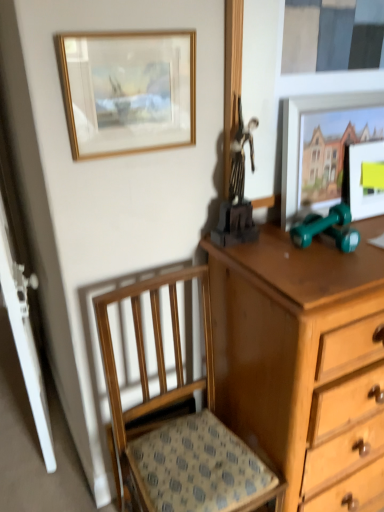
Question: Is shiny black statue at upper center, which is counted as the second toy, starting from the right, positioned behind gold-framed painting at upper left, acting as the first picture frame starting from the left?

Choices:
 (A) no
 (B) yes

Answer: (B)

Question: From the image's perspective, does shiny black statue at upper center, arranged as the 1th toy when viewed from the left, appear higher than gold-framed painting at upper left, acting as the first picture frame starting from the left?

Choices:
 (A) no
 (B) yes

Answer: (A)

Question: From a real-world perspective, is shiny black statue at upper center, arranged as the 1th toy when viewed from the left, under gold-framed painting at upper left, the 3th picture frame viewed from the right?

Choices:
 (A) yes
 (B) no

Answer: (A)

Question: Is shiny black statue at upper center, arranged as the 1th toy when viewed from the left, oriented away from gold-framed painting at upper left, acting as the first picture frame starting from the left?

Choices:
 (A) no
 (B) yes

Answer: (A)

Question: From the image's perspective, is shiny black statue at upper center, arranged as the 1th toy when viewed from the left, under gold-framed painting at upper left, the 3th picture frame viewed from the right?

Choices:
 (A) no
 (B) yes

Answer: (B)

Question: Is point click(370, 156) positioned closer to the camera than point click(140, 120)?

Choices:
 (A) farther
 (B) closer

Answer: (A)

Question: Based on their sizes in the image, would you say matte wooden picture frame at upper right, the 1th picture frame when ordered from right to left, is bigger or smaller than gold-framed painting at upper left, the 3th picture frame viewed from the right?

Choices:
 (A) big
 (B) small

Answer: (A)

Question: Considering the positions of matte wooden picture frame at upper right, the 1th picture frame when ordered from right to left, and gold-framed painting at upper left, acting as the first picture frame starting from the left, in the image, is matte wooden picture frame at upper right, the 1th picture frame when ordered from right to left, taller or shorter than gold-framed painting at upper left, acting as the first picture frame starting from the left,?

Choices:
 (A) tall
 (B) short

Answer: (B)

Question: Is matte wooden picture frame at upper right, the 1th picture frame when ordered from right to left, spatially inside gold-framed painting at upper left, acting as the first picture frame starting from the left, or outside of it?

Choices:
 (A) outside
 (B) inside

Answer: (A)

Question: Considering the positions of green rubber dumbbells at right, the first toy viewed from the right, and wooden chair at lower left in the image, is green rubber dumbbells at right, the first toy viewed from the right, wider or thinner than wooden chair at lower left?

Choices:
 (A) thin
 (B) wide

Answer: (A)

Question: Is green rubber dumbbells at right, the first toy viewed from the right, inside or outside of wooden chair at lower left?

Choices:
 (A) inside
 (B) outside

Answer: (B)

Question: Considering the positions of green rubber dumbbells at right, the first toy viewed from the right, and wooden chair at lower left in the image, is green rubber dumbbells at right, the first toy viewed from the right, bigger or smaller than wooden chair at lower left?

Choices:
 (A) small
 (B) big

Answer: (A)

Question: From the image's perspective, is green rubber dumbbells at right, the first toy viewed from the right, located above or below wooden chair at lower left?

Choices:
 (A) above
 (B) below

Answer: (A)

Question: Considering the relative positions of shiny black statue at upper center, which is counted as the second toy, starting from the right, and wooden chair at lower left in the image provided, is shiny black statue at upper center, which is counted as the second toy, starting from the right, to the left or to the right of wooden chair at lower left?

Choices:
 (A) right
 (B) left

Answer: (A)

Question: Is shiny black statue at upper center, arranged as the 1th toy when viewed from the left, inside or outside of wooden chair at lower left?

Choices:
 (A) outside
 (B) inside

Answer: (A)